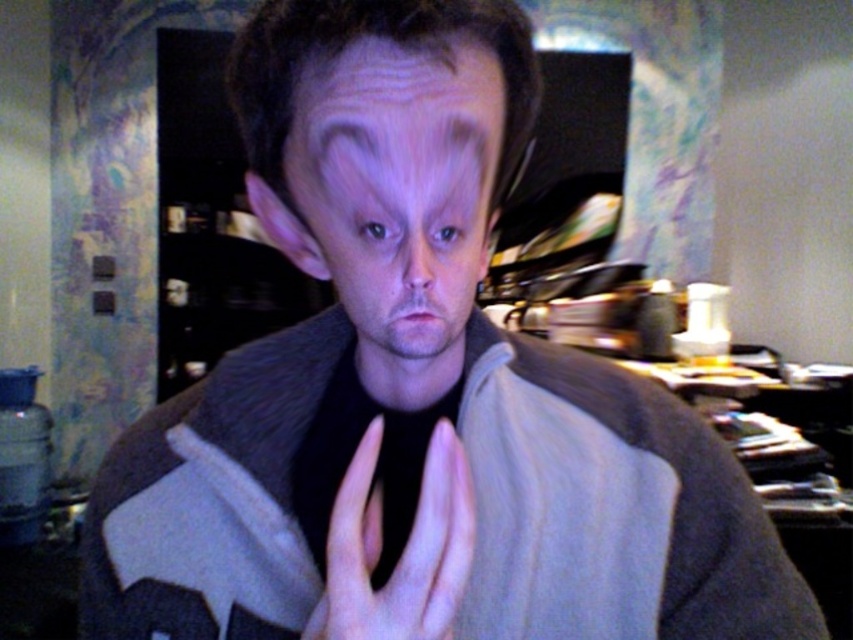
Does matte gray hair at center appear on the right side of skinny white hand at center?

Incorrect, matte gray hair at center is not on the right side of skinny white hand at center.

Which is behind, point (457, 342) or point (409, 531)?

The point (409, 531) is more distant.

Where is `matte gray hair at center`? The width and height of the screenshot is (853, 640). matte gray hair at center is located at coordinates (393, 188).